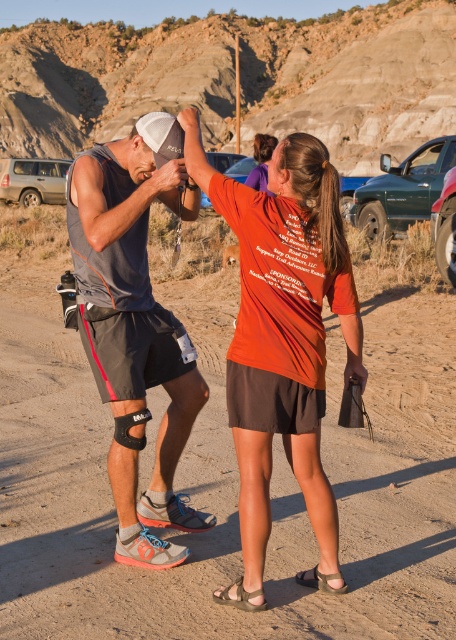
Question: Which object is the closest to the silver metallic suv at upper left?

Choices:
 (A) metallic green truck at right
 (B) metallic silver car at center

Answer: (B)

Question: Which object is the closest to the metallic silver car at center?

Choices:
 (A) metallic green truck at right
 (B) orange cotton shirt at center
 (C) matte gray tank top at center

Answer: (A)

Question: Does matte gray tank top at center have a smaller size compared to orange cotton shirt at center?

Choices:
 (A) yes
 (B) no

Answer: (B)

Question: Is green matte truck at right below silver metallic suv at upper left?

Choices:
 (A) yes
 (B) no

Answer: (A)

Question: Does silver metallic suv at upper left have a smaller size compared to metallic green truck at right?

Choices:
 (A) no
 (B) yes

Answer: (A)

Question: Which object appears farthest from the camera in this image?

Choices:
 (A) matte gray tank top at center
 (B) orange cotton shirt at center
 (C) green matte truck at right

Answer: (C)